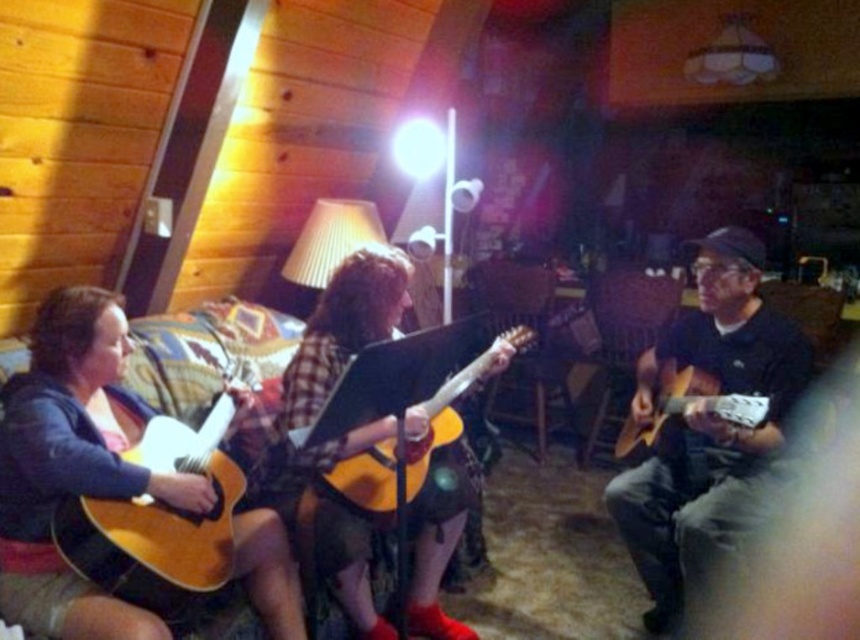
Question: Which of the following is the farthest from the observer?

Choices:
 (A) matte black guitar at center
 (B) matte acoustic guitar at right

Answer: (A)

Question: Which object appears farthest from the camera in this image?

Choices:
 (A) acoustic wood guitar at center
 (B) matte brown guitar at left
 (C) matte black guitar at center

Answer: (C)

Question: Does matte wood guitar at left have a greater width compared to acoustic wood guitar at center?

Choices:
 (A) no
 (B) yes

Answer: (A)

Question: Is wooden acoustic guitar at center to the left of matte wood guitar at left from the viewer's perspective?

Choices:
 (A) no
 (B) yes

Answer: (A)

Question: Which object is the closest to the matte wood guitar at left?

Choices:
 (A) matte acoustic guitar at right
 (B) acoustic wood guitar at center

Answer: (B)

Question: From the image, what is the correct spatial relationship of matte wood guitar at left in relation to acoustic wood guitar at center?

Choices:
 (A) above
 (B) below

Answer: (B)